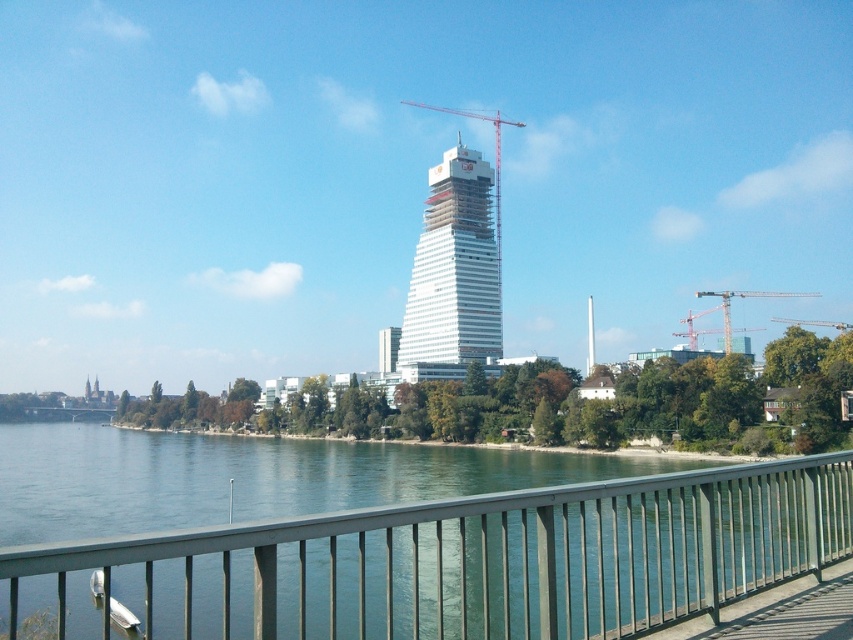
You are a photographer standing on the bridge and want to capture both the white glass building at center and the metallic construction crane at right in a single shot. Based on their positions, will the crane be visible behind the building or in front of it?

The white glass building at center is located above the metallic construction crane at right, so the crane will appear in front of the building in the photo.

You are standing at the waterfront and want to take a photo of the white glass building at center. If your camera has a maximum zoom range of 500 feet, will you be able to capture the building clearly without moving closer?

The white glass building at center is 545.58 feet away from the viewer. Since the camera can only zoom up to 500 feet, you will need to move closer to ensure the building is captured clearly.

What is the coordinate of the white glass building at center? Please answer with the coordinate in the format of a tuple with two decimal numbers, for example, like this format of your answer should be like this exactly like this exactly like this exactly like this exactly like this exactly like this exactly like this exactly like this exactly like this exactly like this exactly like this exactly like this exactly like this exactly like this exactly like this exactly like this exactly like this exactly like

The white glass building at center is located at coordinate point (454, 268).